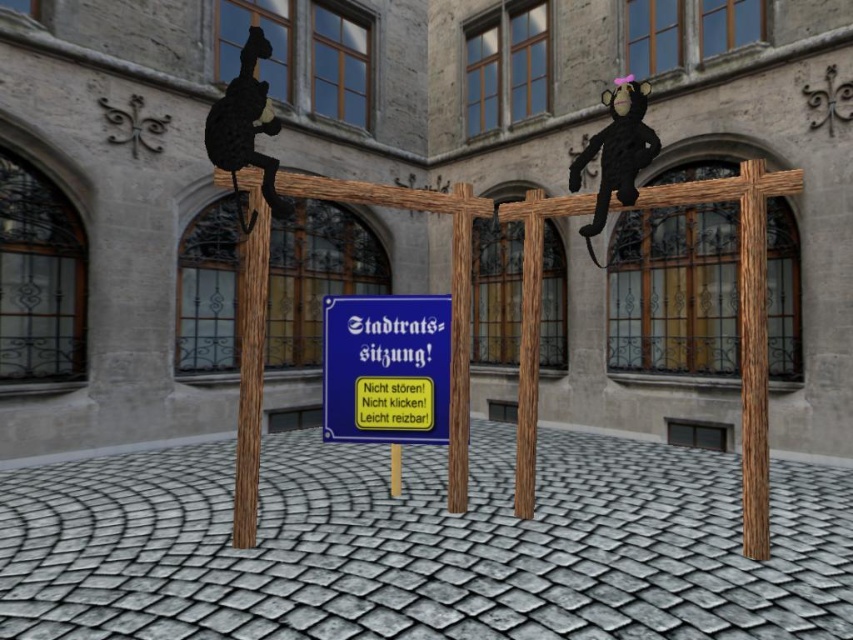
Is blue painted wood sign at center smaller than brown wood pole at center?

Incorrect, blue painted wood sign at center is not smaller in size than brown wood pole at center.

Can you confirm if blue painted wood sign at center is positioned above brown wood pole at center?

Actually, blue painted wood sign at center is below brown wood pole at center.

Is point (338, 369) positioned behind point (524, 413)?

Yes, point (338, 369) is behind point (524, 413).

The width and height of the screenshot is (853, 640). Find the location of `blue painted wood sign at center`. blue painted wood sign at center is located at coordinates (386, 369).

Which is in front, point (328, 337) or point (242, 124)?

Point (242, 124) is in front.

In order to click on blue painted wood sign at center in this screenshot , I will do `click(386, 369)`.

Does point (352, 417) lie in front of point (247, 104)?

No, it is behind (247, 104).

Identify the location of blue painted wood sign at center. The width and height of the screenshot is (853, 640). (386, 369).

Is wooden pole at left wider than black matte cat at upper left?

In fact, wooden pole at left might be narrower than black matte cat at upper left.

Describe the element at coordinates (250, 355) in the screenshot. I see `wooden pole at left` at that location.

Where is `wooden pole at left`? This screenshot has width=853, height=640. wooden pole at left is located at coordinates (250, 355).